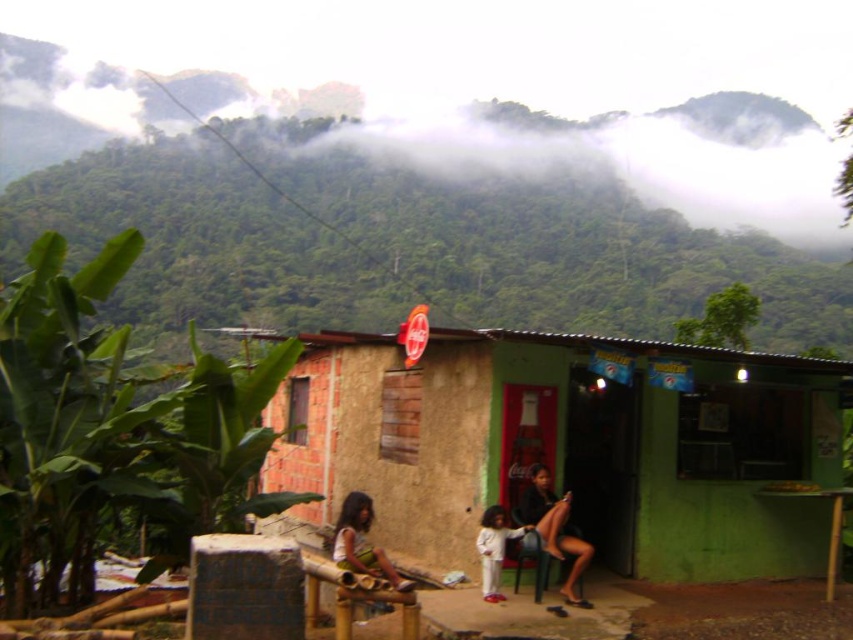
Question: Which is farther from the matte black dress at center?

Choices:
 (A) white matte dress at center
 (B) light brown wooden bench at lower center

Answer: (B)

Question: Is green corrugated metal hut at center positioned at the back of white matte dress at center?

Choices:
 (A) no
 (B) yes

Answer: (B)

Question: Which point is farther to the camera?

Choices:
 (A) (376, 348)
 (B) (343, 509)
 (C) (523, 490)
 (D) (483, 561)

Answer: (A)

Question: Which object appears closest to the camera in this image?

Choices:
 (A) white matte dress at center
 (B) light brown wooden bench at lower center
 (C) green corrugated metal hut at center
 (D) matte black dress at center

Answer: (B)

Question: Can you confirm if green corrugated metal hut at center is positioned to the right of white matte dress at center?

Choices:
 (A) no
 (B) yes

Answer: (B)

Question: Does matte black dress at center have a lesser width compared to white matte dress at center?

Choices:
 (A) yes
 (B) no

Answer: (B)